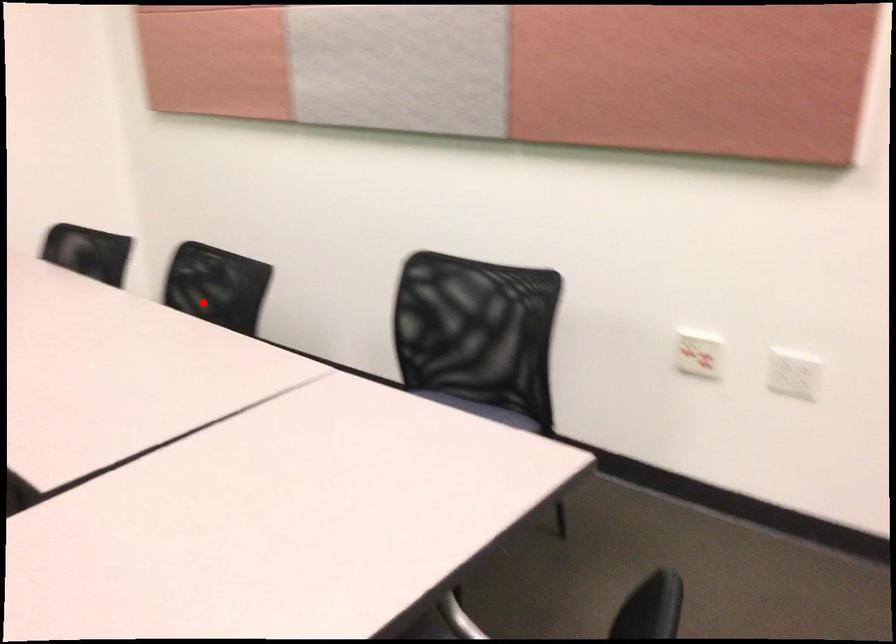
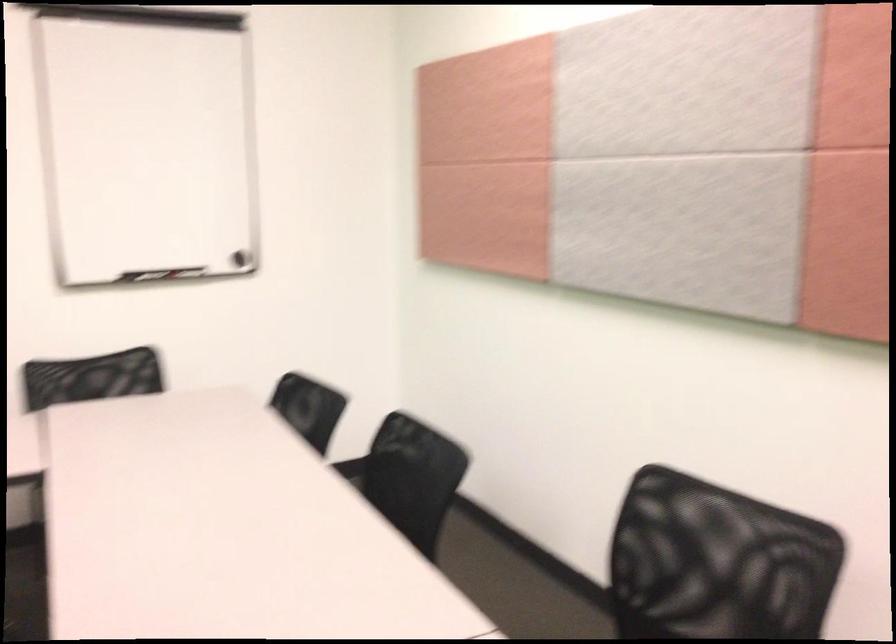
Question: I am providing you with two images of the same scene from different viewpoints. Given a red point in image1, look at the same physical point in image2. Is it:

Choices:
 (A) Closer to the viewpoint
 (B) Farther from the viewpoint

Answer: (A)